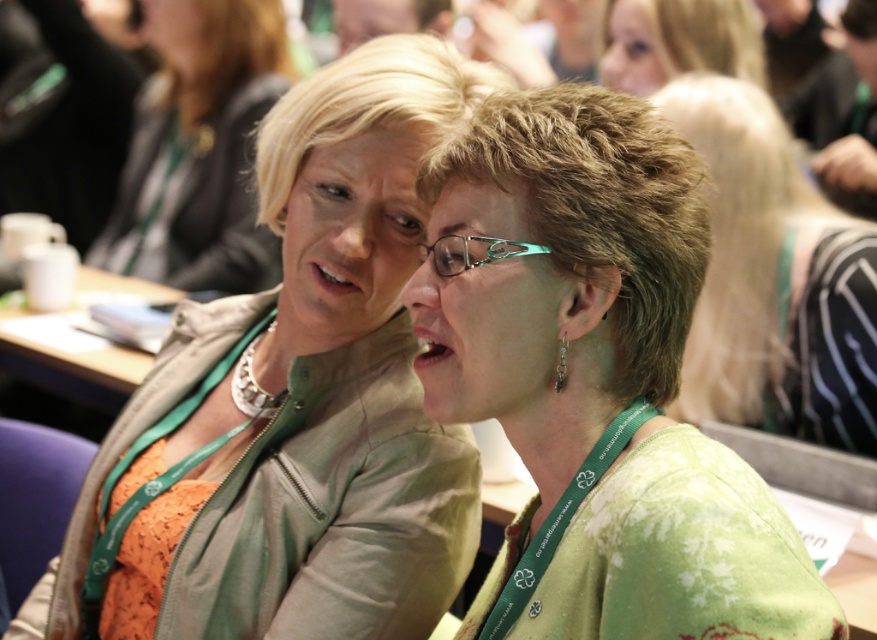
Question: Based on their relative distances, which object is nearer to the green textured blouse at center?

Choices:
 (A) matte green jacket at upper left
 (B) matte green jacket at center
 (C) blonde hair at upper center
 (D) green fabric at center

Answer: (B)

Question: Does matte green jacket at center appear on the right side of green fabric at center?

Choices:
 (A) yes
 (B) no

Answer: (B)

Question: Observing the image, what is the correct spatial positioning of green textured blouse at center in reference to green fabric at center?

Choices:
 (A) below
 (B) above

Answer: (A)

Question: Which of the following is the farthest from the observer?

Choices:
 (A) (824, 342)
 (B) (630, 506)

Answer: (A)

Question: Based on their relative distances, which object is farther from the green fabric at center?

Choices:
 (A) matte green jacket at upper left
 (B) blonde hair at upper center

Answer: (A)

Question: Is the position of matte green jacket at center more distant than that of green textured blouse at center?

Choices:
 (A) no
 (B) yes

Answer: (B)